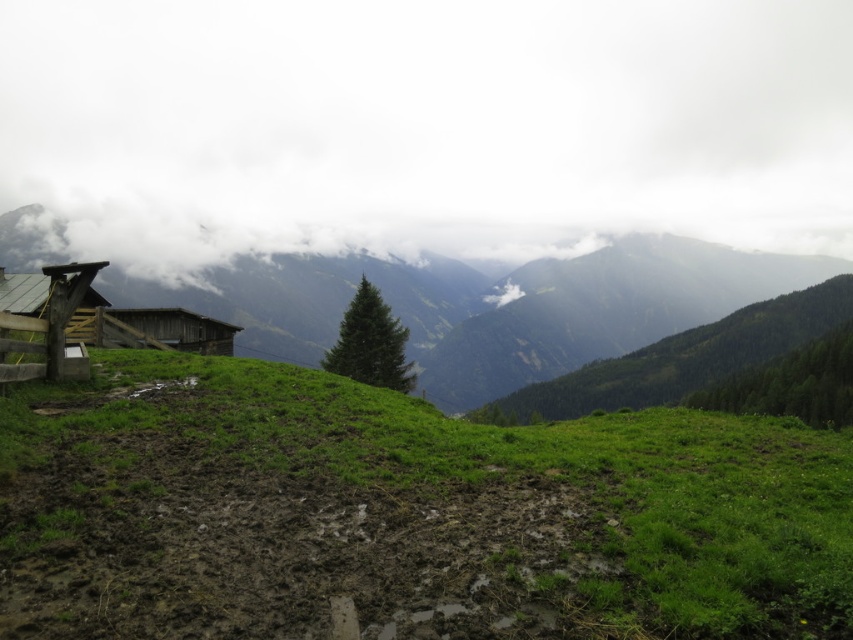
You are a hiker planning to take a photo of the white fluffy cloud at upper center and the green grassy hillside at left. Which object appears higher in the sky?

The white fluffy cloud at upper center appears higher in the sky than the green grassy hillside at left because it is taller than the hillside according to the description.

You are an airplane pilot preparing for takeoff. You notice the white fluffy cloud at upper center and the green grassy hillside at left in your view. Which object is positioned higher in the sky?

The white fluffy cloud at upper center is located above the green grassy hillside at left, so it is positioned higher in the sky.